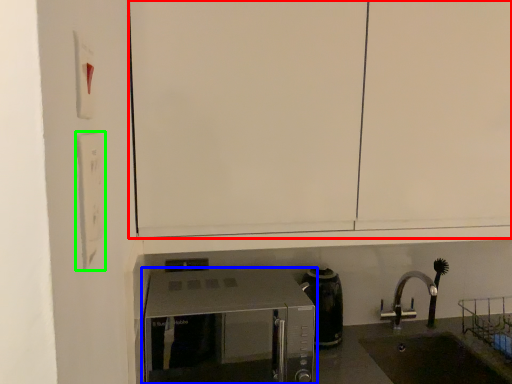
Question: Which object is the farthest from cabinetry (highlighted by a red box)? Choose among these: microwave oven (highlighted by a blue box) or light switch (highlighted by a green box).

Choices:
 (A) microwave oven
 (B) light switch

Answer: (A)